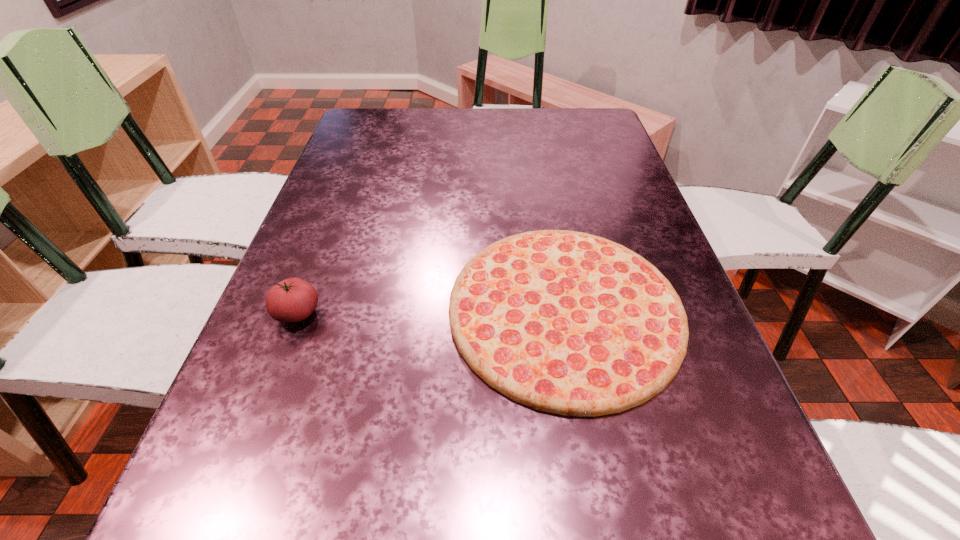
Where is `the left object`? the left object is located at coordinates (292, 300).

Find the location of a particular element. This screenshot has width=960, height=540. the taller object is located at coordinates (292, 300).

Identify the location of pizza. This screenshot has height=540, width=960. (565, 322).

You are a GUI agent. You are given a task and a screenshot of the screen. Output one action in this format:
    pyautogui.click(x=<x>, y=<y>)
    Task: Click on the shorter object
    The height and width of the screenshot is (540, 960).
    Given the screenshot: What is the action you would take?
    pyautogui.click(x=565, y=322)

Image resolution: width=960 pixels, height=540 pixels. Find the location of `vacant space located 0.080m on the right of the left object`. vacant space located 0.080m on the right of the left object is located at coordinates (363, 313).

The height and width of the screenshot is (540, 960). I want to click on vacant space located 0.140m on the left of the pizza, so click(x=377, y=310).

Locate an element on the screen. The height and width of the screenshot is (540, 960). object at the left edge is located at coordinates (292, 300).

You are a GUI agent. You are given a task and a screenshot of the screen. Output one action in this format:
    pyautogui.click(x=<x>, y=<y>)
    Task: Click on the object located in the right edge section of the desktop
    The width and height of the screenshot is (960, 540).
    Given the screenshot: What is the action you would take?
    pyautogui.click(x=565, y=322)

This screenshot has width=960, height=540. In the image, there is a desktop. In order to click on free space at the far edge in this screenshot , I will do `click(431, 114)`.

You are a GUI agent. You are given a task and a screenshot of the screen. Output one action in this format:
    pyautogui.click(x=<x>, y=<y>)
    Task: Click on the vacant position at the left edge of the desktop
    
    Given the screenshot: What is the action you would take?
    pyautogui.click(x=329, y=197)